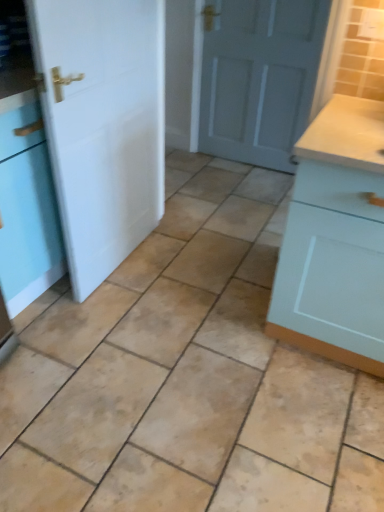
Locate an element on the screen. This screenshot has width=384, height=512. free spot above beige ceramic tile at center (from a real-world perspective) is located at coordinates (172, 356).